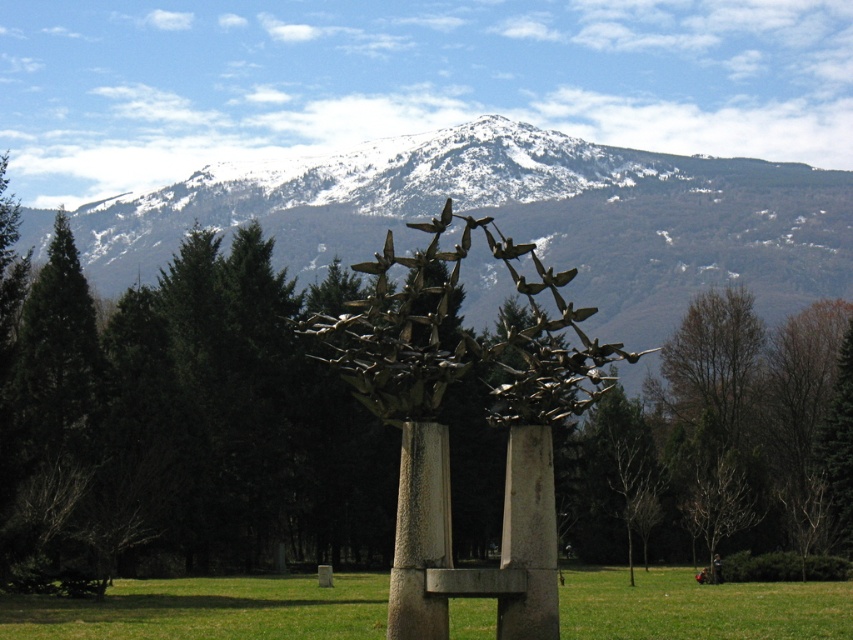
You are standing in front of the sculpture and want to take a photo of both the metallic sculpture at center and the rusty metal pole at center. Which object should you position to your left to capture both in the frame?

You should position the metallic sculpture at center to your left because it is already to the left of the rusty metal pole at center, so placing it on your left will ensure both are in the frame.

You are an artist planning to photograph the metallic sculpture at center and the rusty metal pole at center from a distance. Which object will appear taller in the photo?

The metallic sculpture at center will appear taller in the photo because it has a greater height compared to the rusty metal pole at center.

You are an artist planning to create a miniature version of the sculpture in the image. You want to ensure the proportions between the polished bronze birds at center and the rusty metal pole at center are accurate. Which object should you scale down more to maintain the correct size relationship?

The polished bronze birds at center are larger than the rusty metal pole at center in the original sculpture. To maintain the correct size relationship, you should scale down the polished bronze birds at center more than the rusty metal pole at center.